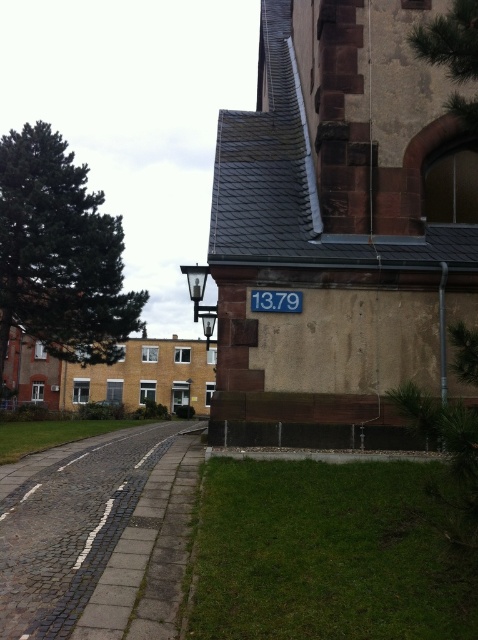
Question: Is cobblestone road at lower left wider than blue painted metal sign at center?

Choices:
 (A) no
 (B) yes

Answer: (B)

Question: Can you confirm if cobblestone road at lower left is smaller than blue painted metal sign at center?

Choices:
 (A) yes
 (B) no

Answer: (B)

Question: Which point is closer to the camera?

Choices:
 (A) (263, 300)
 (B) (94, 556)

Answer: (B)

Question: Which of the following is the closest to the observer?

Choices:
 (A) (295, 291)
 (B) (65, 483)

Answer: (B)

Question: Does cobblestone road at lower left have a greater width compared to blue painted metal sign at center?

Choices:
 (A) yes
 (B) no

Answer: (A)